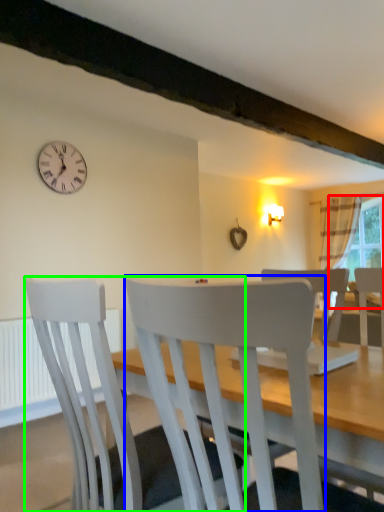
Question: Which is farther away from window screen (highlighted by a red box)? chair (highlighted by a blue box) or chair (highlighted by a green box)?

Choices:
 (A) chair
 (B) chair

Answer: (A)